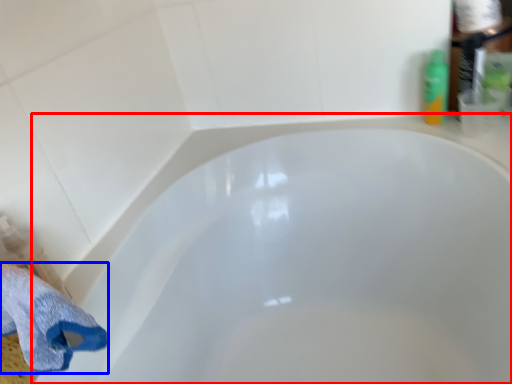
Question: Among these objects, which one is farthest to the camera, bathtub (highlighted by a red box) or bath towel (highlighted by a blue box)?

Choices:
 (A) bathtub
 (B) bath towel

Answer: (B)